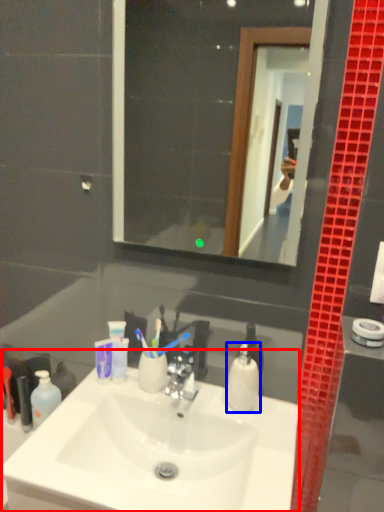
Question: Which point is closer to the camera, sink (highlighted by a red box) or soap dispenser (highlighted by a blue box)?

Choices:
 (A) sink
 (B) soap dispenser

Answer: (A)